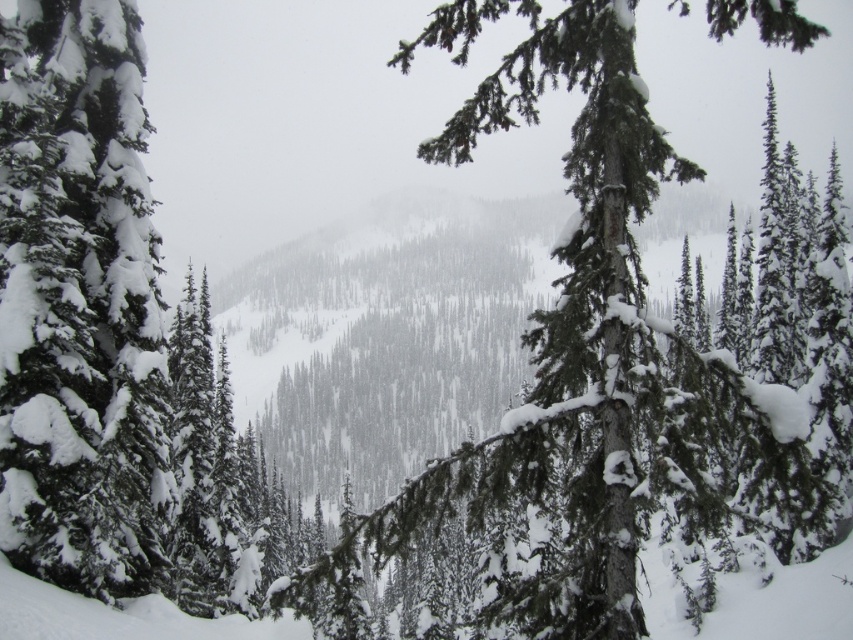
Question: Which of the following is the farthest from the observer?

Choices:
 (A) green textured pine tree at center
 (B) green matte tree at left

Answer: (B)

Question: Which point appears farthest from the camera in this image?

Choices:
 (A) (408, 513)
 (B) (59, 19)

Answer: (B)

Question: In this image, where is green textured pine tree at center located relative to green matte tree at left?

Choices:
 (A) below
 (B) above

Answer: (B)

Question: Does green textured pine tree at center come in front of green matte tree at left?

Choices:
 (A) no
 (B) yes

Answer: (B)

Question: Can you confirm if green textured pine tree at center is positioned above green matte tree at left?

Choices:
 (A) no
 (B) yes

Answer: (B)

Question: Among these objects, which one is farthest from the camera?

Choices:
 (A) green matte tree at left
 (B) green textured pine tree at center

Answer: (A)